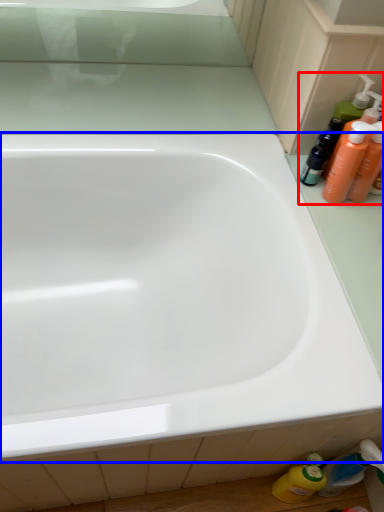
Question: Which object is closer to the camera taking this photo, toiletry (highlighted by a red box) or bathtub (highlighted by a blue box)?

Choices:
 (A) toiletry
 (B) bathtub

Answer: (B)